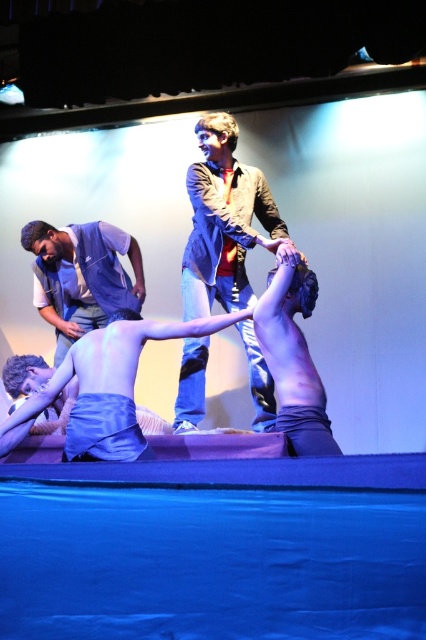
Question: In this image, where is denim jacket at upper center located relative to smooth skin torso at center?

Choices:
 (A) above
 (B) below

Answer: (A)

Question: Which point appears closest to the camera in this image?

Choices:
 (A) tap(264, 380)
 (B) tap(68, 241)
 (C) tap(118, 408)

Answer: (C)

Question: Among these objects, which one is nearest to the camera?

Choices:
 (A) denim vest at left
 (B) smooth skin torso at center

Answer: (B)

Question: Which object is positioned farthest from the denim vest at left?

Choices:
 (A) denim jacket at upper center
 (B) smooth skin torso at center

Answer: (B)

Question: Can you confirm if denim jacket at upper center is positioned below denim vest at left?

Choices:
 (A) yes
 (B) no

Answer: (B)

Question: Does denim jacket at upper center come in front of denim vest at left?

Choices:
 (A) yes
 (B) no

Answer: (A)